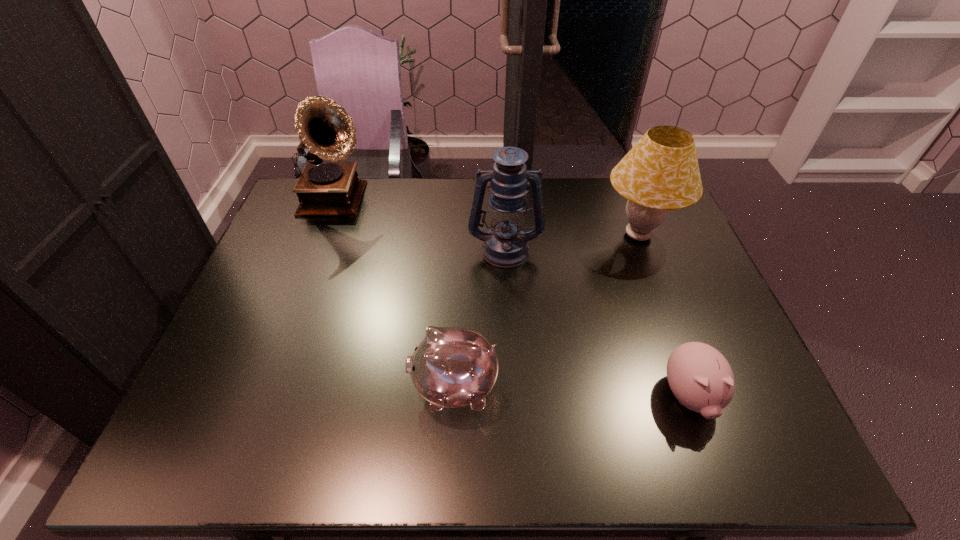
You are a GUI agent. You are given a task and a screenshot of the screen. Output one action in this format:
    pyautogui.click(x=<x>, y=<y>)
    Task: Click on the object that is at the far right corner
    
    Given the screenshot: What is the action you would take?
    pyautogui.click(x=660, y=173)

What are the coordinates of `object situated at the near right corner` in the screenshot? It's located at (700, 377).

Find the location of `vacant space at the far edge of the desktop`. vacant space at the far edge of the desktop is located at coordinates (421, 194).

In the image, there is a desktop. At what (x,y) coordinates should I click in order to perform the action: click on vacant space at the left edge. Please return your answer as a coordinate pair (x, y). The width and height of the screenshot is (960, 540). Looking at the image, I should click on (272, 239).

Identify the location of free space at the right edge of the desktop. This screenshot has height=540, width=960. (676, 256).

Locate an element on the screen. The height and width of the screenshot is (540, 960). empty space between the leftmost object and the shortest object is located at coordinates (513, 300).

Where is `free space between the left piggy bank and the right piggy bank`? This screenshot has width=960, height=540. free space between the left piggy bank and the right piggy bank is located at coordinates (572, 392).

Identify the location of vacant area between the lantern and the leftmost object. The width and height of the screenshot is (960, 540). (420, 226).

You are a GUI agent. You are given a task and a screenshot of the screen. Output one action in this format:
    pyautogui.click(x=<x>, y=<y>)
    Task: Click on the vacant region between the left piggy bank and the leftmost object
    The height and width of the screenshot is (540, 960).
    Given the screenshot: What is the action you would take?
    pyautogui.click(x=396, y=295)

This screenshot has width=960, height=540. Identify the location of vacant point located between the left piggy bank and the lampshade. (546, 311).